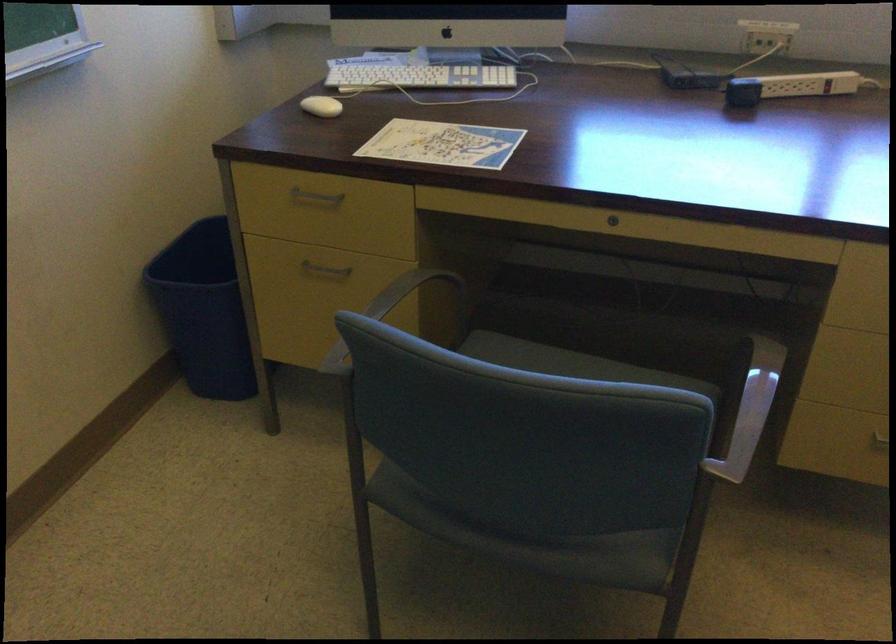
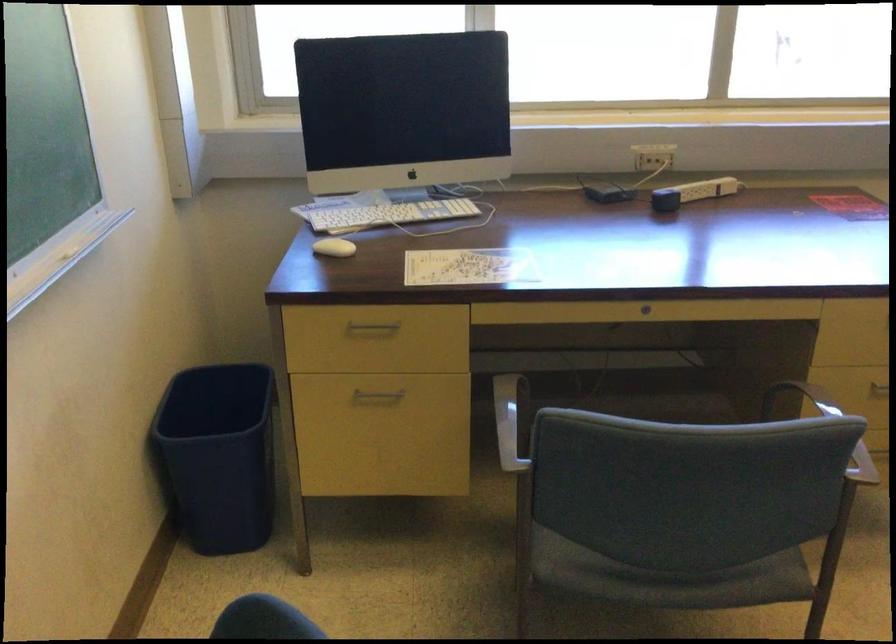
The point at (786, 88) is marked in the first image. Where is the corresponding point in the second image?

(692, 193)